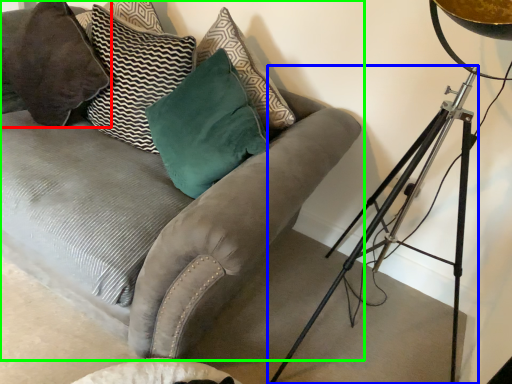
Question: Estimate the real-world distances between objects in this image. Which object is farther from pillow (highlighted by a red box), tripod (highlighted by a blue box) or studio couch (highlighted by a green box)?

Choices:
 (A) tripod
 (B) studio couch

Answer: (A)